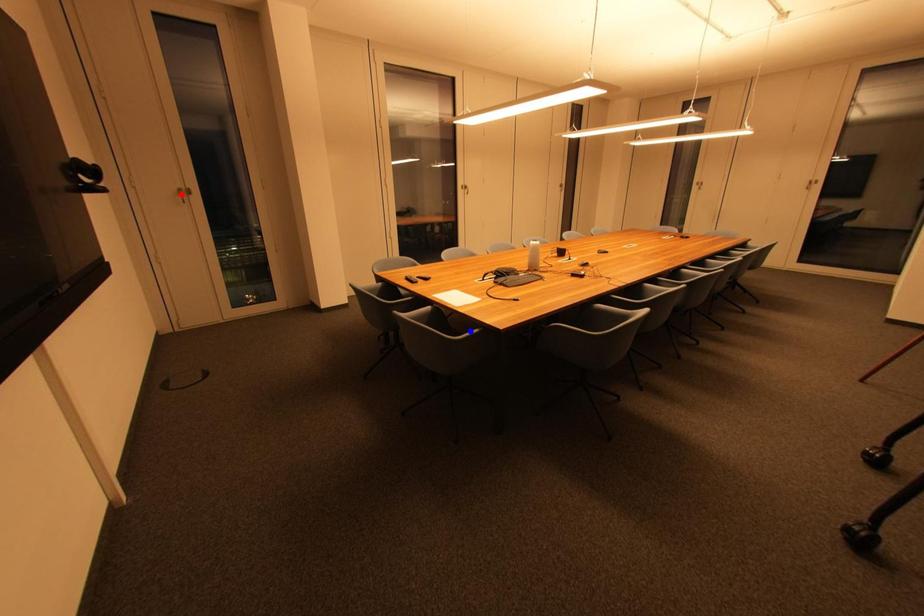
Question: In the image, two points are highlighted. Which point is nearer to the camera? Reply with the corresponding letter.

Choices:
 (A) blue point
 (B) red point

Answer: (A)